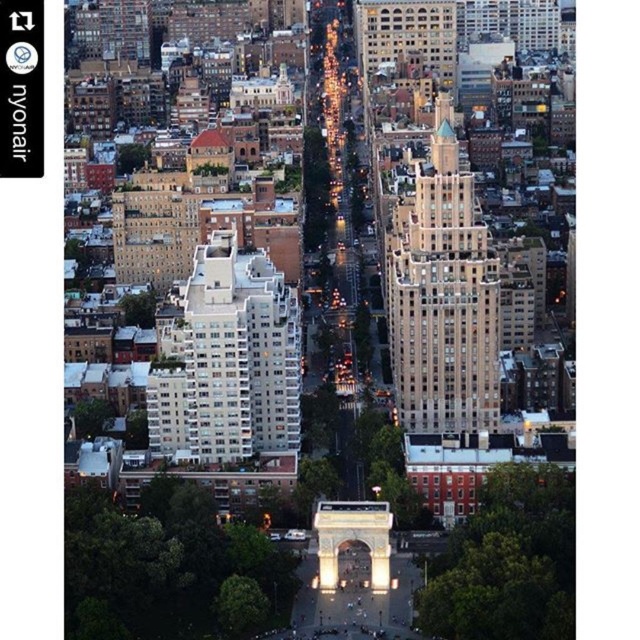
In the scene shown: You are a drone operator tasked with capturing a photo of the beige stone skyscraper at center. Your drone is currently at the coordinates point A. To ensure the skyscraper is centered in the photo, should you adjust your position to the left or right of point A?

The beige stone skyscraper at center is located at point (442,292). Since the question mentions the skyscraper is at the center of the image, the drone should remain at point A to keep it centered. No adjustment is needed.